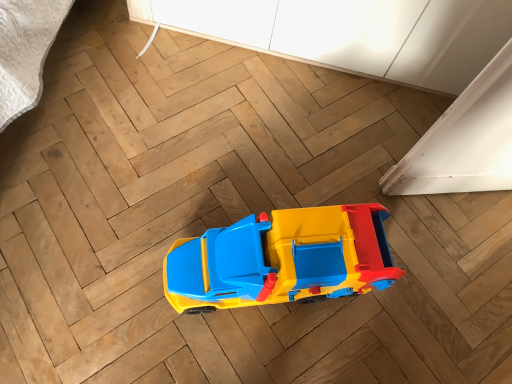
At what (x,y) coordinates should I click in order to perform the action: click on free space that is to the left of matte plastic toy car at center. Please return your answer as a coordinate pair (x, y). Looking at the image, I should click on (136, 236).